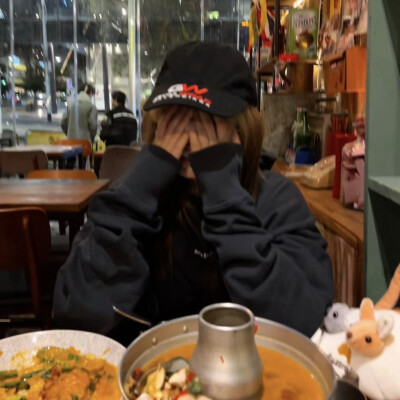
Where is `wooden shelf`? Image resolution: width=400 pixels, height=400 pixels. wooden shelf is located at coordinates (331, 215).